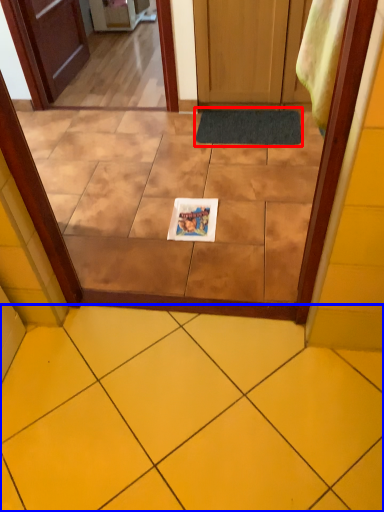
Question: Which point is further to the camera, doormat (highlighted by a red box) or ceramic tile (highlighted by a blue box)?

Choices:
 (A) doormat
 (B) ceramic tile

Answer: (A)